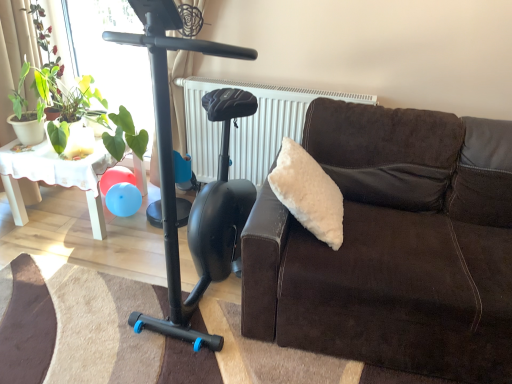
Question: Does green leafy plant at upper left, the second plant positioned from the right, appear on the left side of white textured radiator at upper center?

Choices:
 (A) yes
 (B) no

Answer: (A)

Question: Considering the relative positions of green leafy plant at upper left, which is counted as the 1th plant, starting from the left, and white textured radiator at upper center in the image provided, is green leafy plant at upper left, which is counted as the 1th plant, starting from the left, in front of white textured radiator at upper center?

Choices:
 (A) yes
 (B) no

Answer: (B)

Question: Is green leafy plant at upper left, the second plant positioned from the right, located outside white textured radiator at upper center?

Choices:
 (A) yes
 (B) no

Answer: (A)

Question: Is green leafy plant at upper left, which is counted as the 1th plant, starting from the left, facing away from white textured radiator at upper center?

Choices:
 (A) yes
 (B) no

Answer: (B)

Question: From a real-world perspective, is green leafy plant at upper left, which is counted as the 1th plant, starting from the left, below white textured radiator at upper center?

Choices:
 (A) yes
 (B) no

Answer: (B)

Question: Considering the relative positions of green leafy plant at upper left, which is counted as the 1th plant, starting from the left, and black matte mobility scooter at left in the image provided, is green leafy plant at upper left, which is counted as the 1th plant, starting from the left, to the left or to the right of black matte mobility scooter at left?

Choices:
 (A) right
 (B) left

Answer: (B)

Question: Considering their positions, is green leafy plant at upper left, the second plant positioned from the right, located in front of or behind black matte mobility scooter at left?

Choices:
 (A) behind
 (B) front

Answer: (A)

Question: Considering the positions of green leafy plant at upper left, the second plant positioned from the right, and black matte mobility scooter at left in the image, is green leafy plant at upper left, the second plant positioned from the right, wider or thinner than black matte mobility scooter at left?

Choices:
 (A) thin
 (B) wide

Answer: (A)

Question: Considering the positions of green leafy plant at upper left, which is counted as the 1th plant, starting from the left, and black matte mobility scooter at left in the image, is green leafy plant at upper left, which is counted as the 1th plant, starting from the left, taller or shorter than black matte mobility scooter at left?

Choices:
 (A) short
 (B) tall

Answer: (A)

Question: Is green leafy plant at left, the 2th plant positioned from the left, inside or outside of white lace table at left?

Choices:
 (A) inside
 (B) outside

Answer: (B)

Question: Looking at their shapes, would you say green leafy plant at left, the 2th plant positioned from the left, is wider or thinner than white lace table at left?

Choices:
 (A) wide
 (B) thin

Answer: (B)

Question: From their relative heights in the image, would you say green leafy plant at left, the 2th plant positioned from the left, is taller or shorter than white lace table at left?

Choices:
 (A) short
 (B) tall

Answer: (B)

Question: Relative to white lace table at left, is green leafy plant at left, the 1th plant positioned from the right, in front or behind?

Choices:
 (A) front
 (B) behind

Answer: (A)

Question: Considering their positions, is green leafy plant at left, the 2th plant positioned from the left, located in front of or behind white textured radiator at upper center?

Choices:
 (A) front
 (B) behind

Answer: (A)

Question: From the image's perspective, is green leafy plant at left, the 1th plant positioned from the right, located above or below white textured radiator at upper center?

Choices:
 (A) above
 (B) below

Answer: (A)